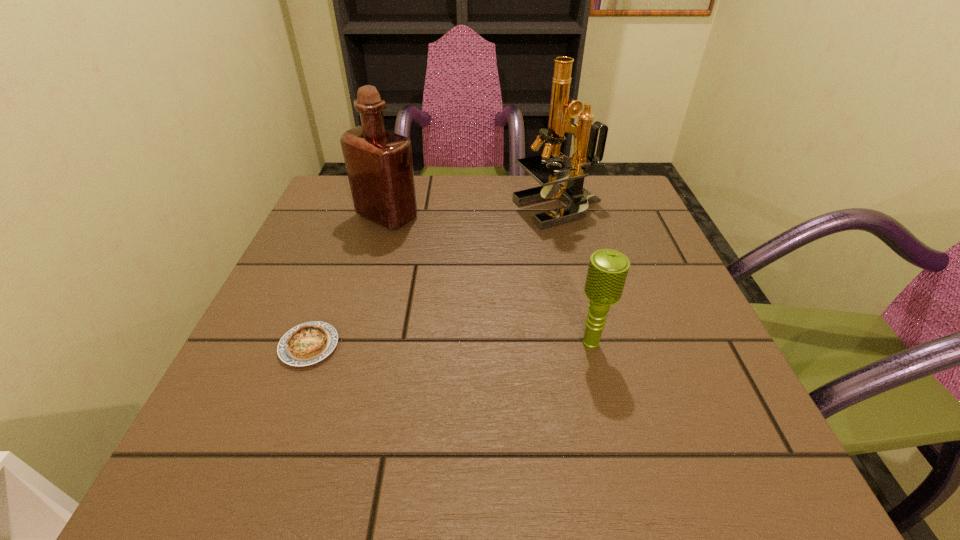
Locate an element on the screen. The image size is (960, 540). free region at the right edge of the desktop is located at coordinates (703, 332).

The image size is (960, 540). I want to click on free location at the far right corner of the desktop, so click(x=625, y=227).

Locate an element on the screen. The width and height of the screenshot is (960, 540). free space between the liquor and the microscope is located at coordinates (473, 213).

This screenshot has height=540, width=960. I want to click on vacant region between the quiche and the microscope, so click(434, 278).

I want to click on unoccupied area between the second tallest object and the third tallest object, so click(489, 280).

Find the location of a particular element. This screenshot has width=960, height=540. free space between the quiche and the third tallest object is located at coordinates (450, 345).

This screenshot has height=540, width=960. Identify the location of free space between the liquor and the shortest object. (348, 281).

Image resolution: width=960 pixels, height=540 pixels. Identify the location of unoccupied area between the shortest object and the second tallest object. (348, 281).

I want to click on free space between the liquor and the quiche, so click(x=348, y=281).

I want to click on free spot between the microscope and the quiche, so click(x=434, y=278).